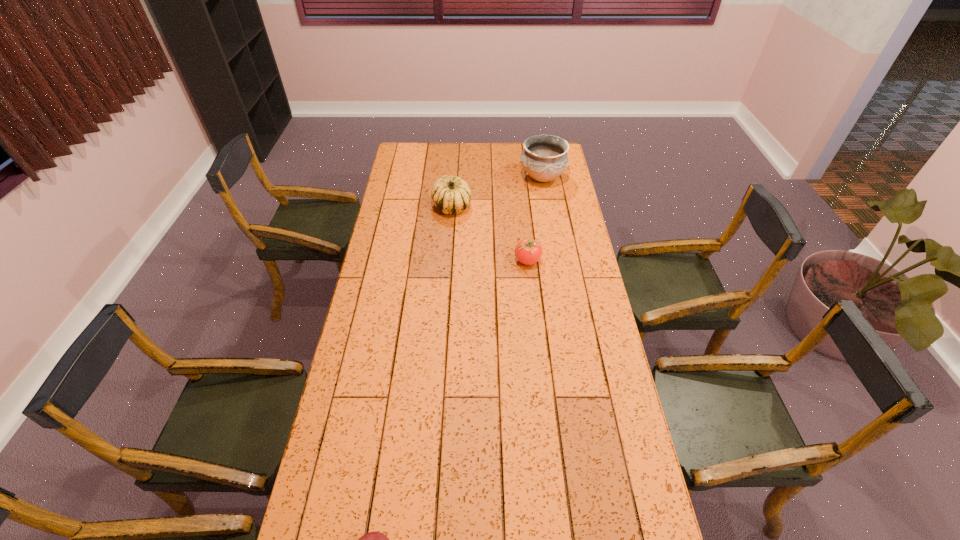
Identify the location of the tallest object. (544, 158).

Identify the location of the farthest object. Image resolution: width=960 pixels, height=540 pixels. (544, 158).

Image resolution: width=960 pixels, height=540 pixels. What are the coordinates of `the third nearest object` in the screenshot? It's located at (451, 195).

Locate an element on the screen. the third shortest object is located at coordinates (451, 195).

Locate an element on the screen. The height and width of the screenshot is (540, 960). the farther tomato is located at coordinates (528, 251).

You are a GUI agent. You are given a task and a screenshot of the screen. Output one action in this format:
    pyautogui.click(x=<x>, y=<y>)
    Task: Click on the second nearest object
    
    Given the screenshot: What is the action you would take?
    pyautogui.click(x=528, y=251)

Locate an element on the screen. The image size is (960, 540). free space located on the front of the tallest object is located at coordinates (554, 244).

Locate an element on the screen. This screenshot has height=540, width=960. vacant space located on the back of the second farthest object is located at coordinates (453, 189).

At what (x,y) coordinates should I click in order to perform the action: click on vacant space located on the back of the third farthest object. Please return your answer as a coordinate pair (x, y). This screenshot has width=960, height=540. Looking at the image, I should click on (525, 234).

Where is `object present at the far edge`? The image size is (960, 540). object present at the far edge is located at coordinates (544, 158).